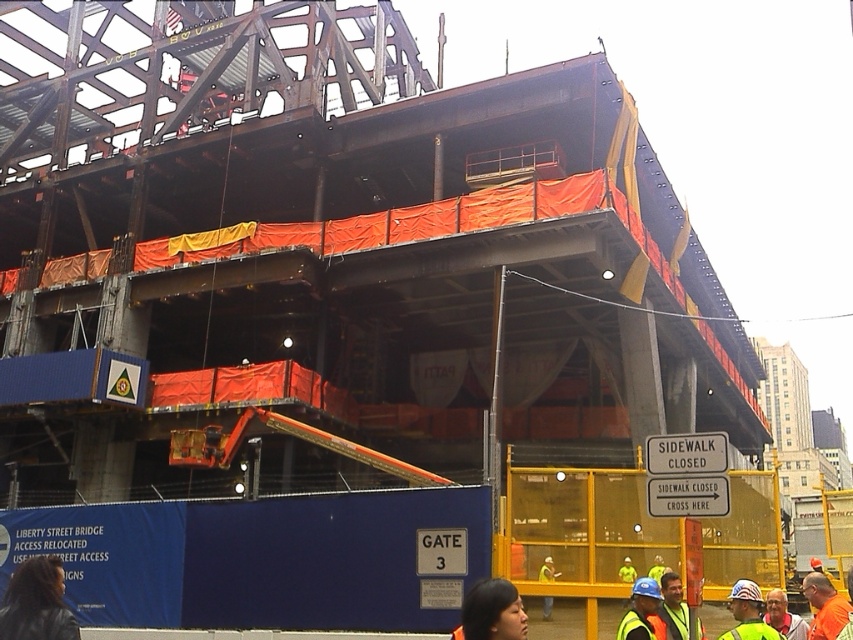
You are a construction worker who needs to choose between the reflective yellow vest at center and the orange safety vest at lower right for visibility. Which vest should you choose if you want to be more visible to the crane operator?

The reflective yellow vest at center has a larger size compared to orange safety vest at lower right, so it would be more visible to the crane operator.

You are a delivery driver arriving at the construction site. You need to park your truck near the reflective yellow vest at center and the orange safety vest at lower right. The truck requires a parking space of at least 10 feet in length. Can you park your truck between these two vests?

The distance between the reflective yellow vest at center and the orange safety vest at lower right is 8.23 feet, which is less than the required 10 feet for the truck. Therefore, you cannot park the truck between these two vests.

Looking at this image, you are a construction worker who needs to locate your safety gear. You see an orange reflective vest at lower right and a reflective safety vest at center. Which vest is closer to the ground?

The orange reflective vest at lower right is located below the reflective safety vest at center, so it is closer to the ground.